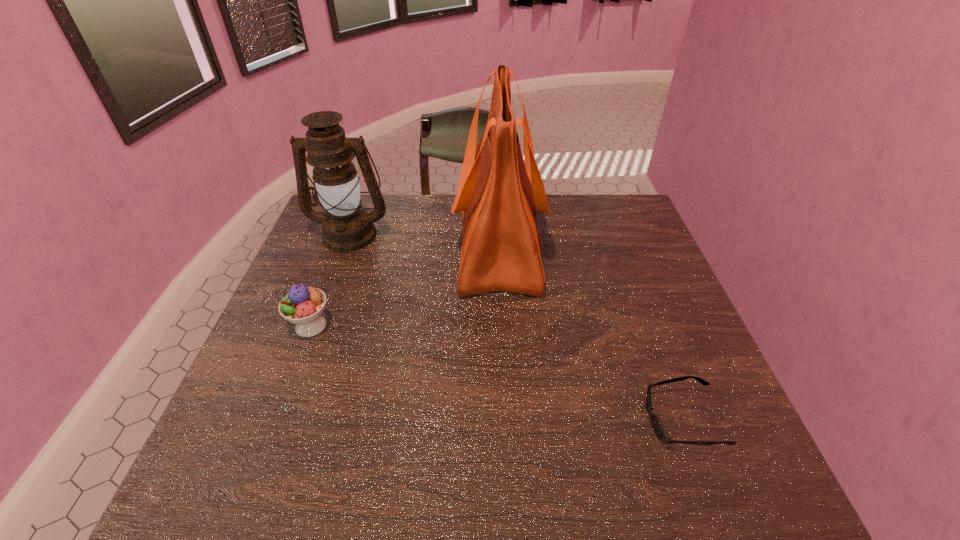
Find the location of a particular element. free space between the second tallest object and the third object from left to right is located at coordinates (424, 239).

What are the coordinates of `free space between the third shortest object and the shortest object` in the screenshot? It's located at (516, 327).

Locate an element on the screen. The height and width of the screenshot is (540, 960). free point between the second tallest object and the nearest object is located at coordinates (516, 327).

The height and width of the screenshot is (540, 960). I want to click on blank region between the rightmost object and the oil lamp, so (x=516, y=327).

You are a GUI agent. You are given a task and a screenshot of the screen. Output one action in this format:
    pyautogui.click(x=<x>, y=<y>)
    Task: Click on the free point between the icecream and the oil lamp
    This screenshot has height=540, width=960.
    Given the screenshot: What is the action you would take?
    pyautogui.click(x=330, y=280)

This screenshot has height=540, width=960. Identify the location of free space between the third tallest object and the sunglasses. (496, 373).

Identify which object is the nearest to the second tallest object. Please provide its 2D coordinates. Your answer should be formatted as a tuple, i.e. [(x, y)], where the tuple contains the x and y coordinates of a point satisfying the conditions above.

[(498, 194)]

You are a GUI agent. You are given a task and a screenshot of the screen. Output one action in this format:
    pyautogui.click(x=<x>, y=<y>)
    Task: Click on the object that stands as the second closest to the shortest object
    
    Given the screenshot: What is the action you would take?
    coord(303,306)

You are a GUI agent. You are given a task and a screenshot of the screen. Output one action in this format:
    pyautogui.click(x=<x>, y=<y>)
    Task: Click on the vacant space that satisfies the following two spatial constraints: 1. on the back side of the third farthest object; 2. on the right side of the third shortest object
    
    Given the screenshot: What is the action you would take?
    pyautogui.click(x=346, y=234)